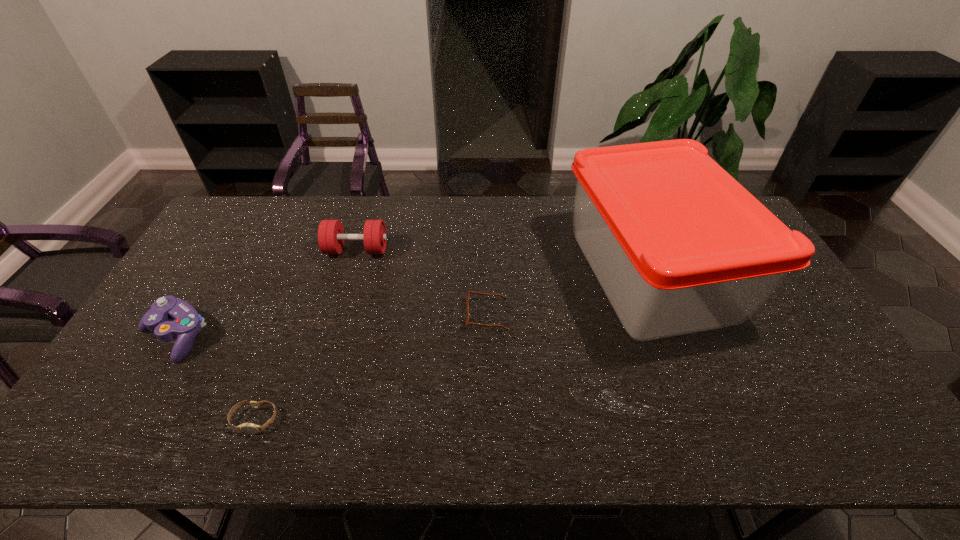
Locate an element on the screen. The image size is (960, 540). free region located 0.280m on the front-facing side of the spectacles is located at coordinates (368, 314).

Identify the location of vacant space located 0.150m on the front-facing side of the spectacles. Image resolution: width=960 pixels, height=540 pixels. (413, 314).

Where is `vacant space located on the front-facing side of the spectacles`? The height and width of the screenshot is (540, 960). vacant space located on the front-facing side of the spectacles is located at coordinates (353, 314).

Find the location of a particular element. The height and width of the screenshot is (540, 960). object at the far edge is located at coordinates (679, 246).

Where is `object that is at the near edge`? The height and width of the screenshot is (540, 960). object that is at the near edge is located at coordinates (249, 428).

Locate an element on the screen. This screenshot has height=540, width=960. object that is positioned at the left edge is located at coordinates (187, 323).

Find the location of a particular element. object that is at the right edge is located at coordinates (679, 246).

This screenshot has width=960, height=540. I want to click on object present at the far right corner, so click(x=679, y=246).

You are a GUI agent. You are given a task and a screenshot of the screen. Output one action in this format:
    pyautogui.click(x=<x>, y=<y>)
    Task: Click on the vacant space at the far edge
    Image resolution: width=960 pixels, height=540 pixels.
    Given the screenshot: What is the action you would take?
    click(477, 197)

Where is `free space at the near edge of the desktop`? free space at the near edge of the desktop is located at coordinates (646, 418).